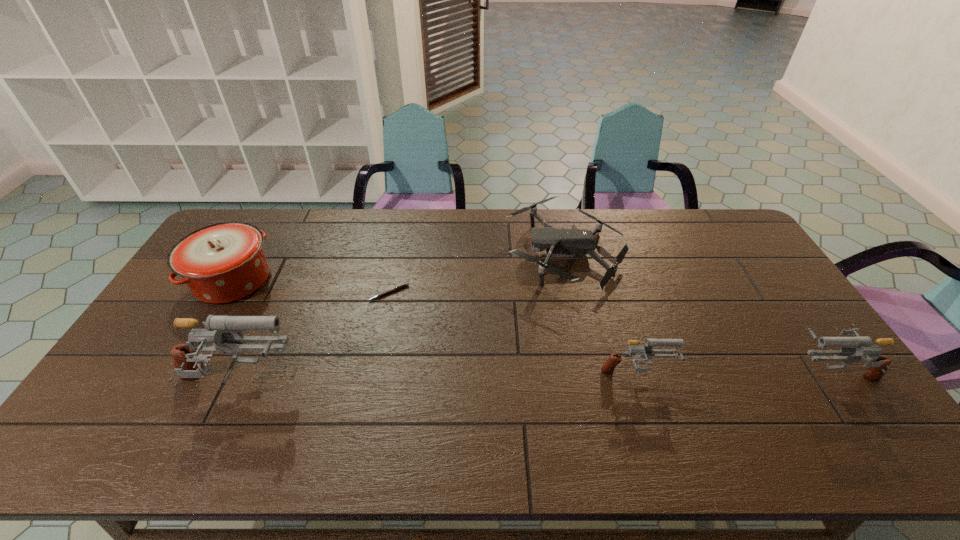
What are the coordinates of `free space between the fourth tallest object and the leftmost gun` in the screenshot? It's located at pos(437,379).

This screenshot has width=960, height=540. What are the coordinates of `unoccupied position between the shortest gun and the drone` in the screenshot? It's located at (601, 314).

Where is `blank region between the casserole and the drone`? The width and height of the screenshot is (960, 540). blank region between the casserole and the drone is located at coordinates (398, 267).

I want to click on free space between the rightmost gun and the casserole, so click(x=533, y=326).

Locate an element on the screen. vacant area that lies between the casserole and the leftmost gun is located at coordinates (235, 332).

Where is `empty location between the tallest object and the second shortest object`? empty location between the tallest object and the second shortest object is located at coordinates (401, 319).

I want to click on free point between the drone and the casserole, so click(x=398, y=267).

Image resolution: width=960 pixels, height=540 pixels. What are the coordinates of `unoccupied area between the casserole and the second shortest object` in the screenshot? It's located at (398, 267).

The image size is (960, 540). I want to click on free space between the drone and the shortest object, so click(x=477, y=273).

At what (x,y) coordinates should I click in order to perform the action: click on free space that is in between the tallest object and the third shortest object. Please return your answer as a coordinate pair (x, y). This screenshot has height=540, width=960. Looking at the image, I should click on (x=437, y=379).